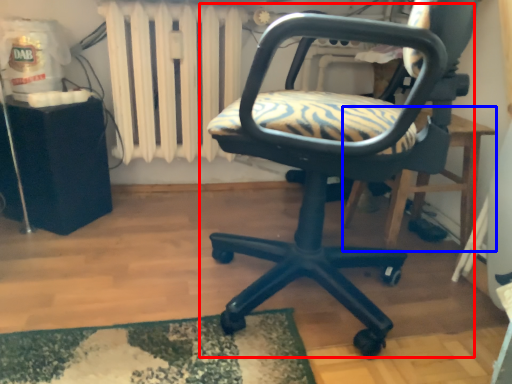
Question: Which point is further to the camera, chair (highlighted by a red box) or table (highlighted by a blue box)?

Choices:
 (A) chair
 (B) table

Answer: (B)